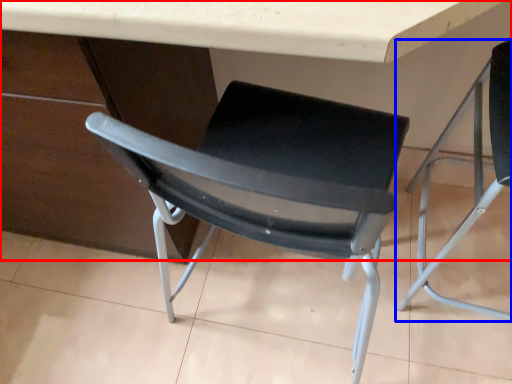
Question: Which object appears farthest to the camera in this image, table (highlighted by a red box) or chair (highlighted by a blue box)?

Choices:
 (A) table
 (B) chair

Answer: (B)